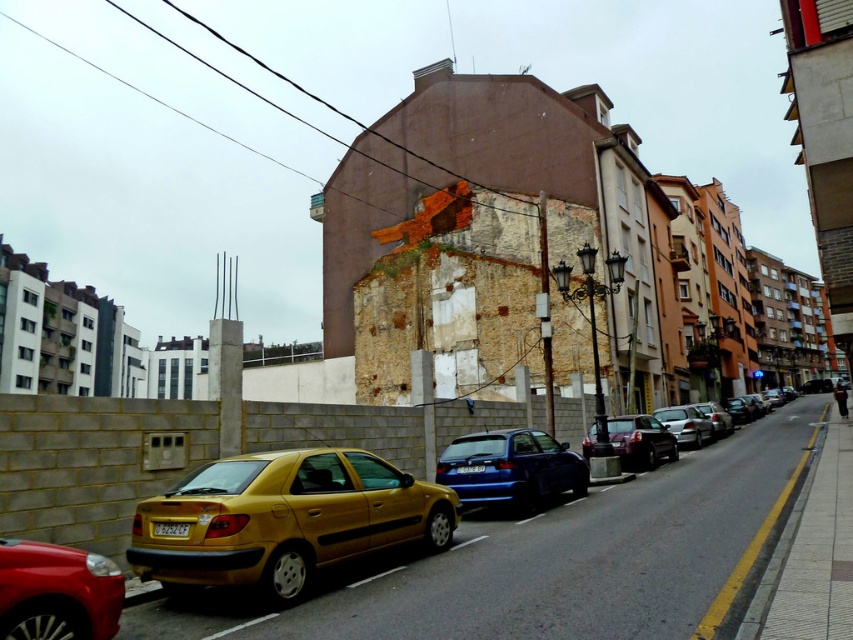
You are a delivery driver who needs to park your van, which is 2 meters wide, in this urban street scene. You see the shiny red car at lower left and the blue plastic license plate at center. Can you fit your van between them?

The shiny red car at lower left is wider than the blue plastic license plate at center. Since the van is 2 meters wide, you need to check the available space between them. However, without knowing the exact distance between the two objects, it is impossible to determine if the van will fit.

You are standing on the sidewalk looking at the parked cars along the street. There is a point marked at coordinates (640, 440) in the image. Which car does this point correspond to?

The point at coordinates (640, 440) corresponds to the shiny metallic car at center.